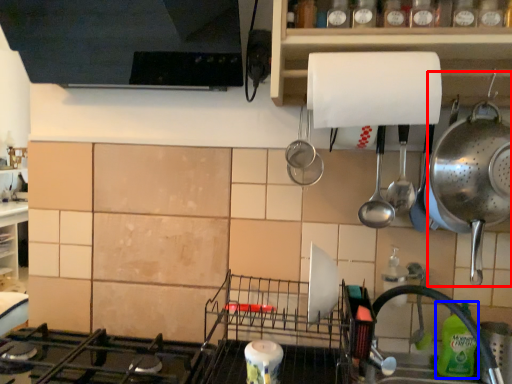
Question: Which point is closer to the camera, appliance (highlighted by a red box) or bottle (highlighted by a blue box)?

Choices:
 (A) appliance
 (B) bottle

Answer: (A)